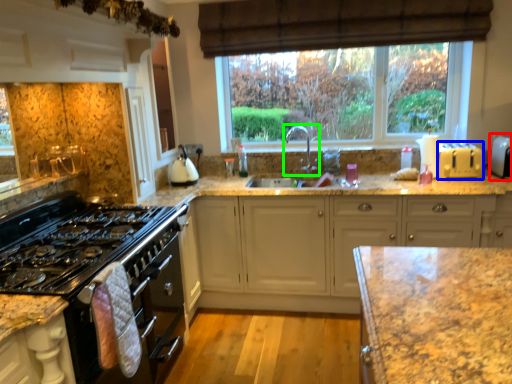
Question: Considering the real-world distances, which object is closest to appliance (highlighted by a red box)? appliance (highlighted by a blue box) or tap (highlighted by a green box).

Choices:
 (A) appliance
 (B) tap

Answer: (A)